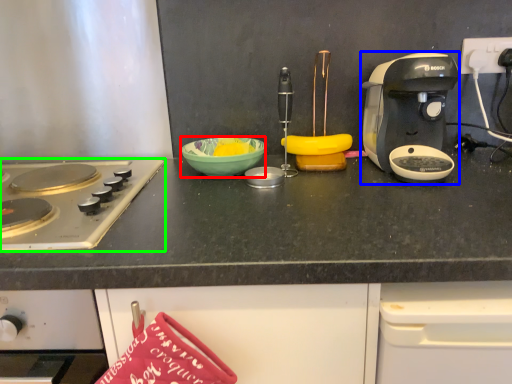
Question: Which is farther away from bowl (highlighted by a red box)? coffee maker (highlighted by a blue box) or gas stove (highlighted by a green box)?

Choices:
 (A) coffee maker
 (B) gas stove

Answer: (A)